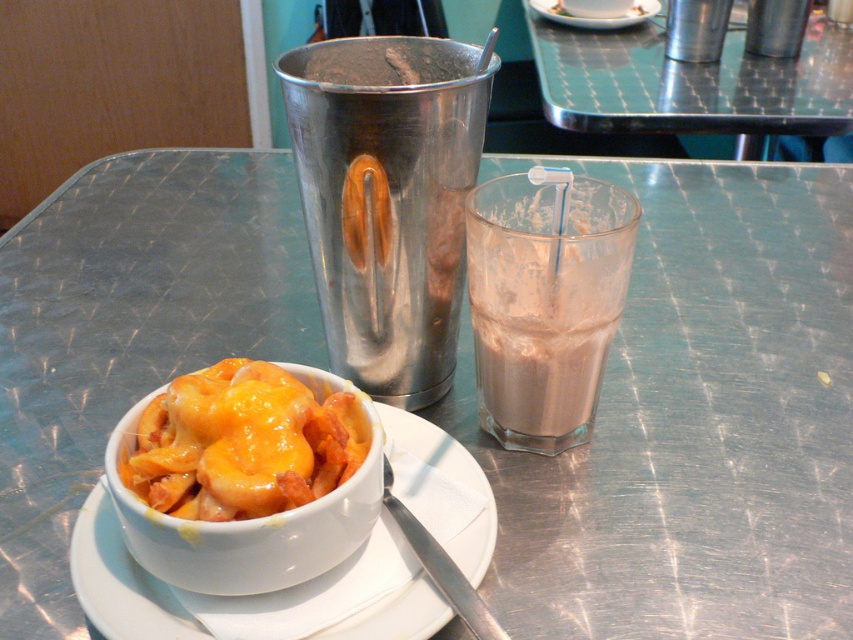
Which is above, brushed metal shaker at upper center or cheesy bread at center?

Positioned higher is brushed metal shaker at upper center.

This screenshot has width=853, height=640. Find the location of `brushed metal shaker at upper center`. brushed metal shaker at upper center is located at coordinates (387, 198).

Who is more distant from viewer, [529,8] or [258,502]?

Positioned behind is point [529,8].

Between brushed metal table at upper center and cheesy bread at center, which one is positioned lower?

cheesy bread at center

Which is in front, point (610, 115) or point (218, 404)?

Point (218, 404)

Locate an element on the screen. brushed metal table at upper center is located at coordinates coord(691,83).

Is white ceramic saucer at lower left positioned behind matte white bowl at lower left?

That is False.

Does white ceramic saucer at lower left have a smaller size compared to matte white bowl at lower left?

Correct, white ceramic saucer at lower left occupies less space than matte white bowl at lower left.

You are a GUI agent. You are given a task and a screenshot of the screen. Output one action in this format:
    pyautogui.click(x=<x>, y=<y>)
    Task: Click on the white ceramic saucer at lower left
    The width and height of the screenshot is (853, 640).
    Given the screenshot: What is the action you would take?
    pyautogui.click(x=120, y=580)